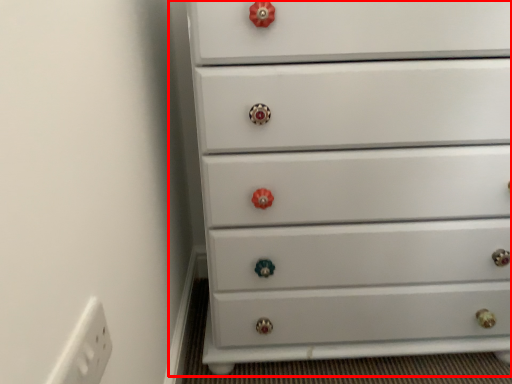
Question: From the image's perspective, what is the correct spatial positioning of chest of drawers (annotated by the red box) in reference to electric outlet?

Choices:
 (A) above
 (B) below

Answer: (A)